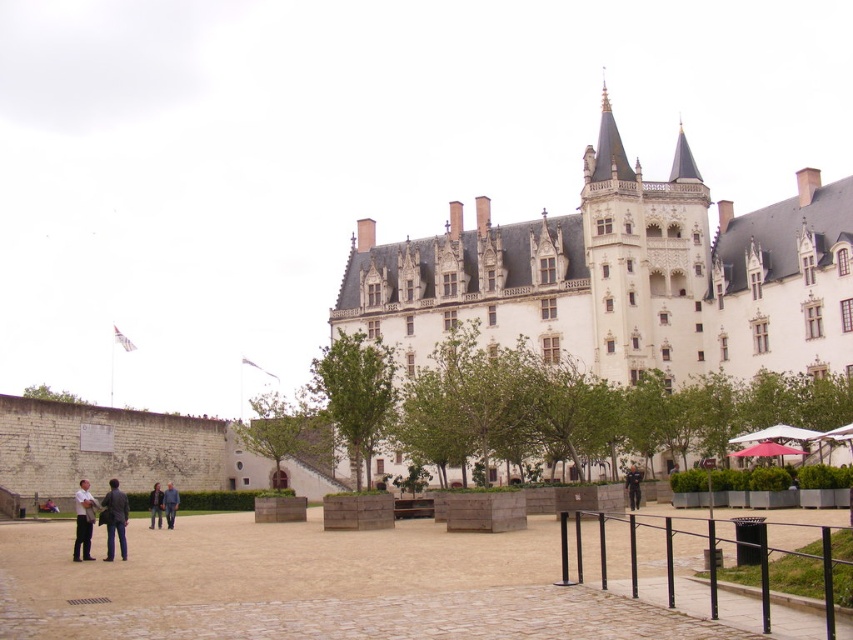
You are standing in front of the grand historic building and want to reach the brown stone plaza at center. According to the image, in which direction should you head from your current position?

The brown stone plaza at center is located at point coordinates, so you should head towards the center of the image to reach it.